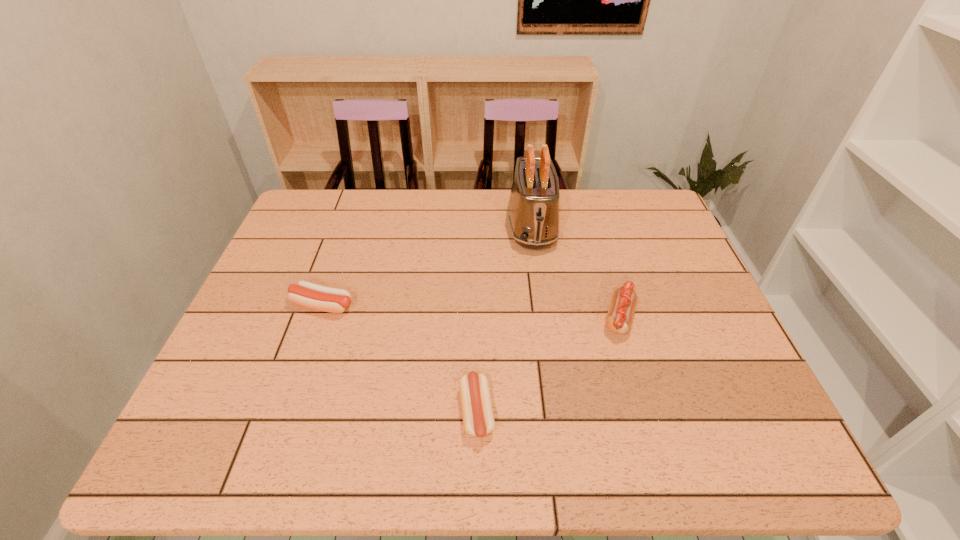
Locate an element on the screen. blank region between the tallest sausage and the leftmost sausage is located at coordinates (470, 312).

Locate an element on the screen. The width and height of the screenshot is (960, 540). free space that is in between the third object from right to left and the rightmost object is located at coordinates (547, 366).

What are the coordinates of `vacant region between the rightmost sausage and the third object from left to right` in the screenshot? It's located at (575, 272).

Identify the location of vacant area between the tallest sausage and the second object from left to right. (547, 366).

Locate an element on the screen. The width and height of the screenshot is (960, 540). free point between the nearest object and the toaster is located at coordinates (504, 320).

Identify the location of vacant area between the second object from right to left and the leftmost object. The height and width of the screenshot is (540, 960). (427, 266).

Find the location of a particular element. The image size is (960, 540). unoccupied area between the third object from right to left and the rightmost object is located at coordinates (547, 366).

This screenshot has height=540, width=960. I want to click on free space between the farthest object and the leftmost object, so click(427, 266).

Locate an element on the screen. vacant area that lies between the second sausage from right to left and the rightmost object is located at coordinates (547, 366).

I want to click on object that is the third closest to the second tallest object, so click(334, 300).